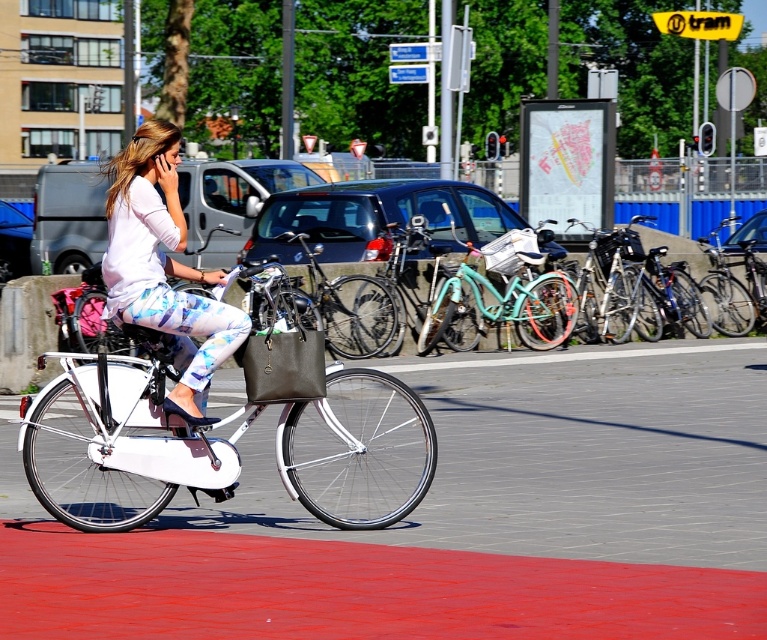
From the picture: Does matte white bicycle at center have a greater width compared to teal matte bicycle basket at center?

Yes, matte white bicycle at center is wider than teal matte bicycle basket at center.

Does matte white bicycle at center appear over teal matte bicycle basket at center?

Incorrect, matte white bicycle at center is not positioned above teal matte bicycle basket at center.

Between point (122, 166) and point (504, 234), which one is positioned behind?

Positioned behind is point (504, 234).

Identify the location of matte white bicycle at center. (163, 266).

Is white matte bicycle at center wider than shiny silver bicycle at right?

Incorrect, white matte bicycle at center's width does not surpass shiny silver bicycle at right's.

Where is `white matte bicycle at center`? This screenshot has width=767, height=640. white matte bicycle at center is located at coordinates [219, 444].

This screenshot has width=767, height=640. Identify the location of white matte bicycle at center. [x=219, y=444].

Consider the image. Is matte white bicycle at center closer to camera compared to teal matte bicycle at center?

Yes, matte white bicycle at center is in front of teal matte bicycle at center.

Is point (224, 310) behind point (522, 298)?

No, (224, 310) is in front of (522, 298).

The image size is (767, 640). What do you see at coordinates (163, 266) in the screenshot? I see `matte white bicycle at center` at bounding box center [163, 266].

Identify the location of matte white bicycle at center. (163, 266).